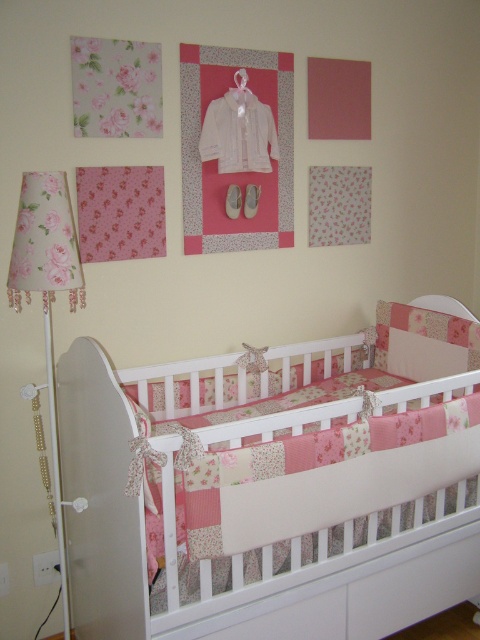
Is point (188, 497) positioned behind point (62, 172)?

No, it is in front of (62, 172).

Between white patchwork crib at lower left and floral fabric lampshade at left, which one appears on the right side from the viewer's perspective?

white patchwork crib at lower left

I want to click on white patchwork crib at lower left, so click(275, 484).